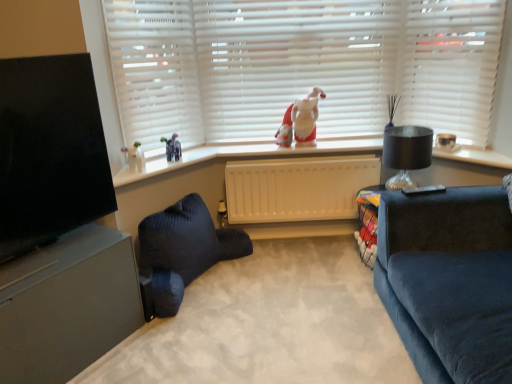
Question: Does white matte blinds at upper center, the first blind in the left-to-right sequence, appear on the left side of black glass lampshade at right?

Choices:
 (A) no
 (B) yes

Answer: (B)

Question: From the image's perspective, is white matte blinds at upper center, the second blind in the right-to-left sequence, beneath black glass lampshade at right?

Choices:
 (A) yes
 (B) no

Answer: (B)

Question: Is white matte blinds at upper center, the first blind in the left-to-right sequence, completely or partially outside of black glass lampshade at right?

Choices:
 (A) yes
 (B) no

Answer: (A)

Question: Is white matte blinds at upper center, the first blind in the left-to-right sequence, shorter than black glass lampshade at right?

Choices:
 (A) no
 (B) yes

Answer: (A)

Question: Considering the relative sizes of white matte blinds at upper center, the second blind in the right-to-left sequence, and black glass lampshade at right in the image provided, is white matte blinds at upper center, the second blind in the right-to-left sequence, smaller than black glass lampshade at right?

Choices:
 (A) yes
 (B) no

Answer: (B)

Question: From a real-world perspective, is white matte blinds at upper center, the second blind in the right-to-left sequence, physically below black glass lampshade at right?

Choices:
 (A) yes
 (B) no

Answer: (B)

Question: Considering the relative positions of white fabric santa at center and velvet dark blue pillow at lower left in the image provided, is white fabric santa at center behind velvet dark blue pillow at lower left?

Choices:
 (A) no
 (B) yes

Answer: (B)

Question: Is white fabric santa at center far away from velvet dark blue pillow at lower left?

Choices:
 (A) yes
 (B) no

Answer: (A)

Question: Is white fabric santa at center facing away from velvet dark blue pillow at lower left?

Choices:
 (A) no
 (B) yes

Answer: (A)

Question: Can you confirm if white fabric santa at center is smaller than velvet dark blue pillow at lower left?

Choices:
 (A) yes
 (B) no

Answer: (A)

Question: Does white fabric santa at center have a lesser width compared to velvet dark blue pillow at lower left?

Choices:
 (A) yes
 (B) no

Answer: (A)

Question: Is velvet dark blue pillow at lower left surrounded by white fabric santa at center?

Choices:
 (A) yes
 (B) no

Answer: (B)

Question: Does dark blue fabric studio couch at lower center come behind white matte blinds at upper center, the first blind from the right?

Choices:
 (A) no
 (B) yes

Answer: (A)